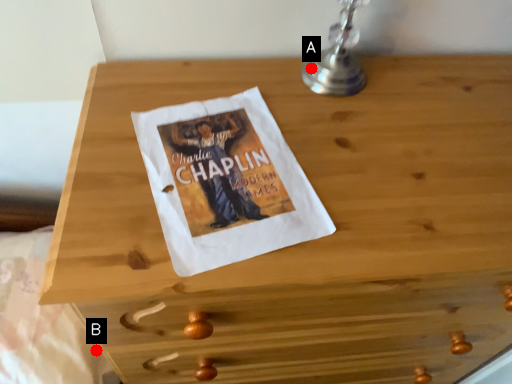
Question: Two points are circled on the image, labeled by A and B beside each circle. Among these points, which one is farthest from the camera?

Choices:
 (A) A is further
 (B) B is further

Answer: (B)